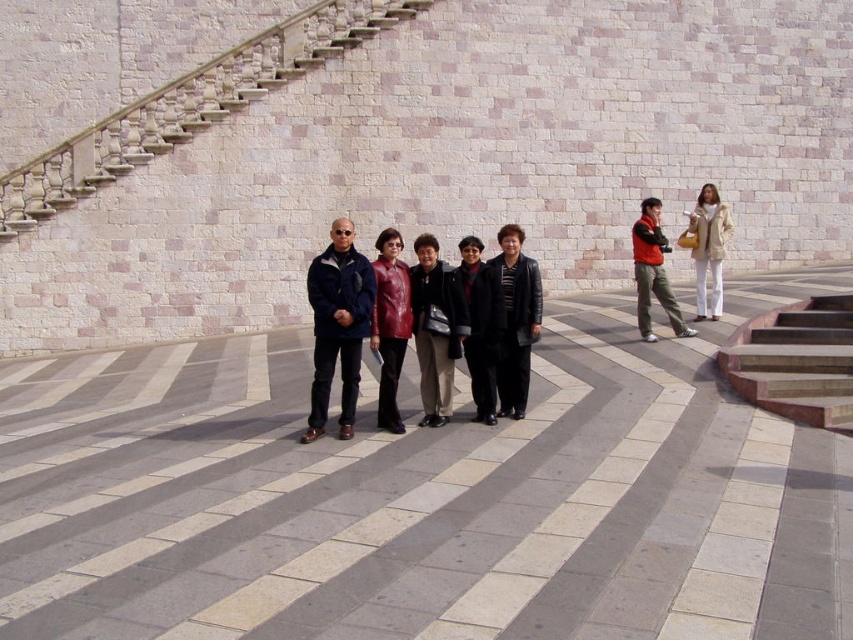
Does black leather jacket at center have a greater height compared to matte red jacket at center?

Incorrect, black leather jacket at center's height is not larger of matte red jacket at center's.

Is black leather jacket at center thinner than matte red jacket at center?

Yes, black leather jacket at center is thinner than matte red jacket at center.

Is point (523, 237) farther from viewer compared to point (648, 216)?

No.

Identify the location of black leather jacket at center. This screenshot has height=640, width=853. (515, 320).

Can you confirm if matte black jacket at center is smaller than shiny red leather jacket at center?

Actually, matte black jacket at center might be larger than shiny red leather jacket at center.

Which is more to the right, matte black jacket at center or shiny red leather jacket at center?

From the viewer's perspective, matte black jacket at center appears more on the right side.

Measure the distance between point (436,248) and camera.

Point (436,248) and camera are 9.48 meters apart from each other.

Locate an element on the screen. The width and height of the screenshot is (853, 640). matte black jacket at center is located at coordinates (434, 326).

Can you confirm if wooden steps at right is thinner than shiny red leather jacket at center?

No, wooden steps at right is not thinner than shiny red leather jacket at center.

Is wooden steps at right positioned before shiny red leather jacket at center?

Yes.

Is point (824, 384) less distant than point (387, 253)?

No, it is not.

You are a GUI agent. You are given a task and a screenshot of the screen. Output one action in this format:
    pyautogui.click(x=<x>, y=<y>)
    Task: Click on the wooden steps at right
    This screenshot has height=640, width=853.
    Given the screenshot: What is the action you would take?
    click(x=796, y=362)